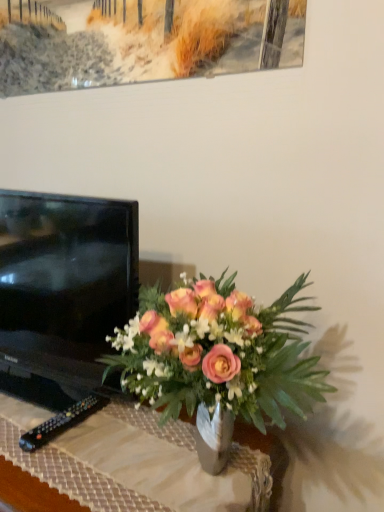
Find the location of `free spot behind black plastic remote at lower left`. free spot behind black plastic remote at lower left is located at coordinates (56, 399).